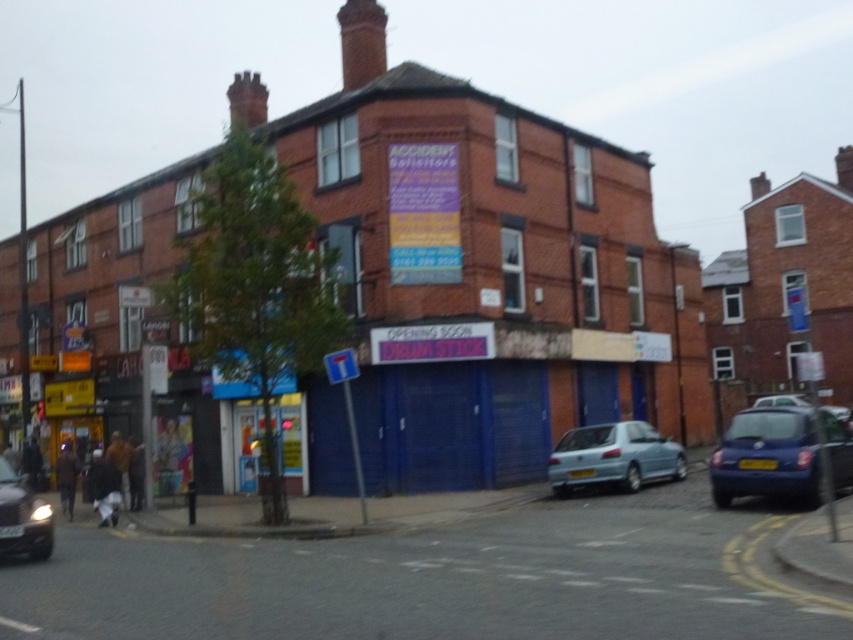
You are a delivery person needing to park your vehicle between the light blue metallic car at lower center and the shiny silver car at lower left. Which side should you park on to fit between them?

You should park on the right side of the shiny silver car at lower left because the light blue metallic car at lower center is positioned on the right side of it, creating space between them.

You are a delivery person who needs to park your truck, which is 2.5 meters wide, between the light blue metallic car at lower center and the shiny silver car at lower left. Based on the scene, can your truck fit in that space?

The light blue metallic car at lower center might be wider than shiny silver car at lower left, so it is uncertain whether the space between them can accommodate a 2.5 meter wide truck. Further measurement or confirmation is needed.